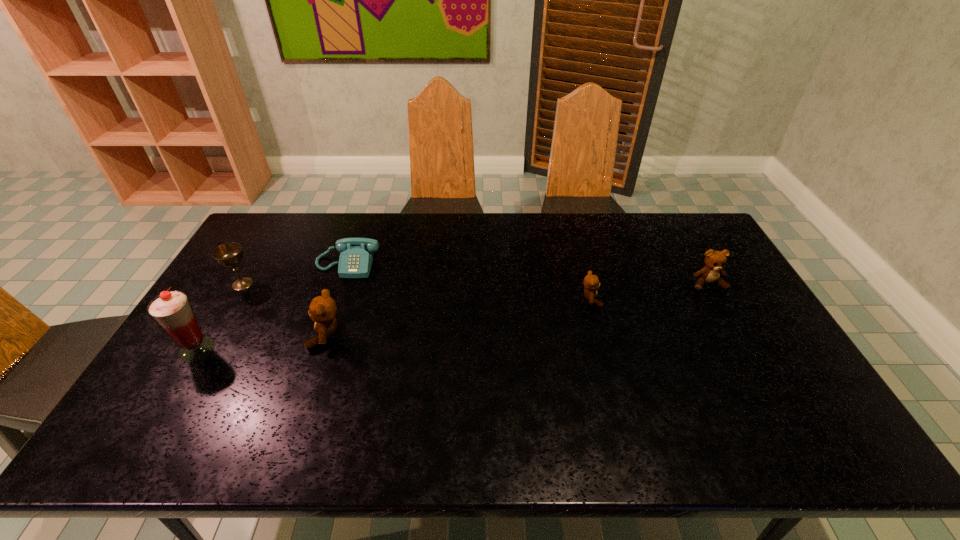
Locate an element on the screen. The image size is (960, 540). vacant space located 0.270m on the front-facing side of the nearest teddy bear is located at coordinates [x=215, y=335].

You are a GUI agent. You are given a task and a screenshot of the screen. Output one action in this format:
    pyautogui.click(x=<x>, y=<y>)
    Task: Click on the free space located on the front-facing side of the nearest teddy bear
    The width and height of the screenshot is (960, 540).
    Given the screenshot: What is the action you would take?
    pyautogui.click(x=226, y=335)

The width and height of the screenshot is (960, 540). I want to click on vacant region located 0.200m on the front-facing side of the shortest teddy bear, so click(x=665, y=299).

Where is `free space located on the front-facing side of the rightmost teddy bear`? free space located on the front-facing side of the rightmost teddy bear is located at coordinates (745, 350).

The image size is (960, 540). I want to click on free space located on the right of the chalice, so click(302, 284).

You are a GUI agent. You are given a task and a screenshot of the screen. Output one action in this format:
    pyautogui.click(x=<x>, y=<y>)
    Task: Click on the free space located on the dial of the telephone
    
    Given the screenshot: What is the action you would take?
    pyautogui.click(x=324, y=333)

You are a GUI agent. You are given a task and a screenshot of the screen. Output one action in this format:
    pyautogui.click(x=<x>, y=<y>)
    Task: Click on the free space located on the right of the tallest object
    
    Given the screenshot: What is the action you would take?
    pyautogui.click(x=283, y=349)

I want to click on object that is positioned at the far edge, so click(356, 256).

Where is `chalice at the left edge`? The image size is (960, 540). chalice at the left edge is located at coordinates (229, 254).

Where is `smoothie that is at the left edge`? The height and width of the screenshot is (540, 960). smoothie that is at the left edge is located at coordinates (172, 310).